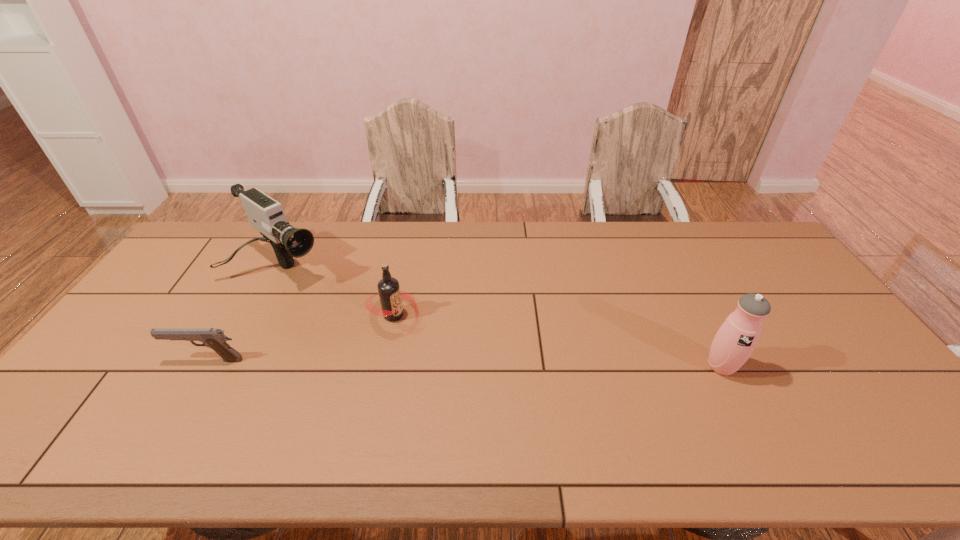
This screenshot has width=960, height=540. I want to click on vacant area that lies between the pistol and the thermos bottle, so click(x=464, y=363).

Choose which object is the second nearest neighbor to the camcorder. Please provide its 2D coordinates. Your answer should be formatted as a tuple, i.e. [(x, y)], where the tuple contains the x and y coordinates of a point satisfying the conditions above.

[(215, 339)]

The height and width of the screenshot is (540, 960). I want to click on object that ranks as the second closest to the second shortest object, so click(215, 339).

You are a GUI agent. You are given a task and a screenshot of the screen. Output one action in this format:
    pyautogui.click(x=<x>, y=<y>)
    Task: Click on the free space in the image that satisfies the following two spatial constraints: 1. on the front side of the thermos bottle; 2. on the left side of the farthest object
    
    Given the screenshot: What is the action you would take?
    pyautogui.click(x=226, y=366)

The image size is (960, 540). I want to click on free space that satisfies the following two spatial constraints: 1. on the front side of the rightmost object; 2. on the right side of the camcorder, so click(226, 366).